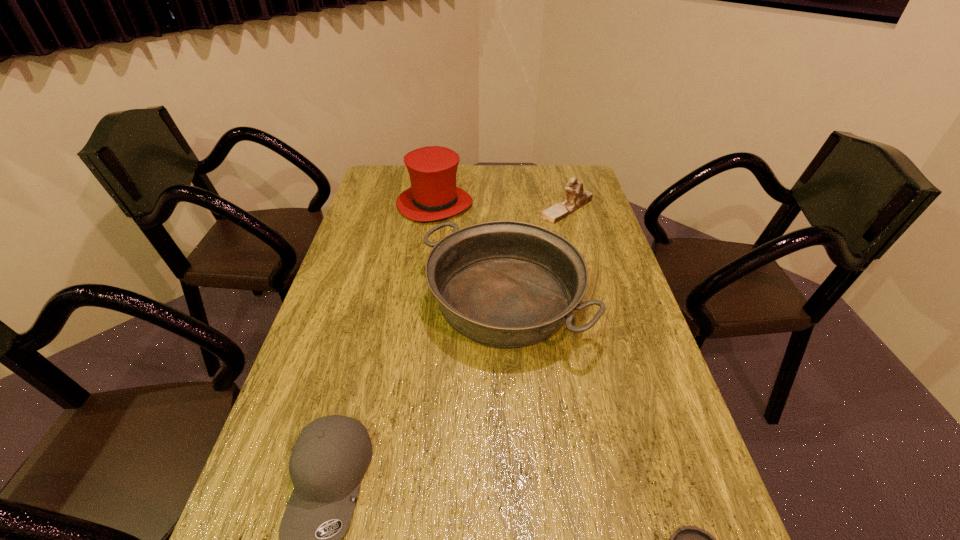
Identify the location of object present at the left edge. The height and width of the screenshot is (540, 960). (433, 195).

This screenshot has height=540, width=960. What are the coordinates of `pan located at the right edge` in the screenshot? It's located at [x=507, y=284].

Where is `figurine that is at the right edge`? The image size is (960, 540). figurine that is at the right edge is located at coordinates (576, 197).

Identify the location of object that is at the far left corner. This screenshot has width=960, height=540. (433, 195).

Identify the location of object that is positioned at the far right corner. (576, 197).

What are the coordinates of `vacant area at the far edge of the desktop` in the screenshot? It's located at (507, 195).

Where is `free spot at the left edge of the desktop`? free spot at the left edge of the desktop is located at coordinates (312, 412).

This screenshot has width=960, height=540. Identify the location of vacant space at the right edge of the desktop. pos(593,211).

Select which object is the third closest to the pan. Please provide its 2D coordinates. Your answer should be formatted as a tuple, i.e. [(x, y)], where the tuple contains the x and y coordinates of a point satisfying the conditions above.

[(576, 197)]

Point out which object is positioned as the third nearest to the figurine. Please provide its 2D coordinates. Your answer should be formatted as a tuple, i.e. [(x, y)], where the tuple contains the x and y coordinates of a point satisfying the conditions above.

[(332, 453)]